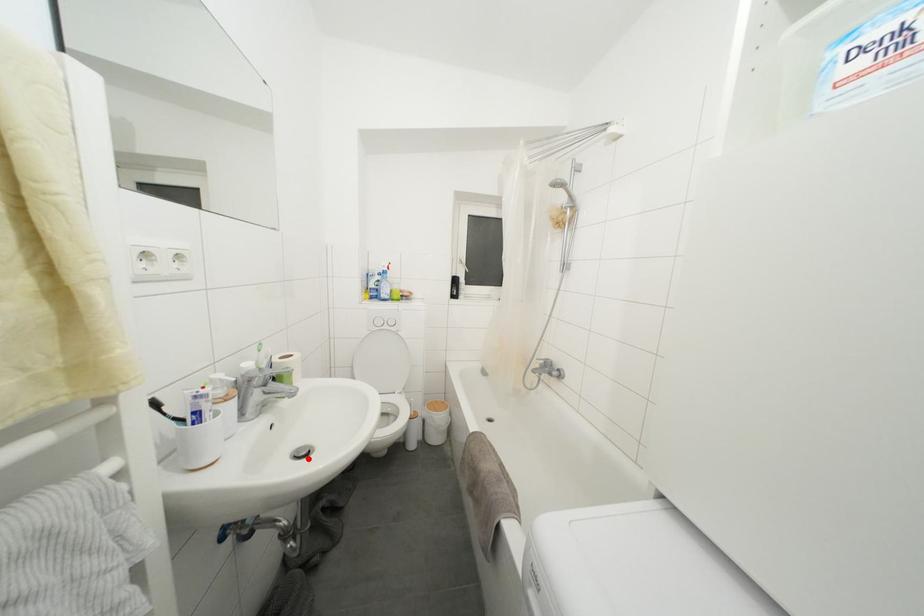
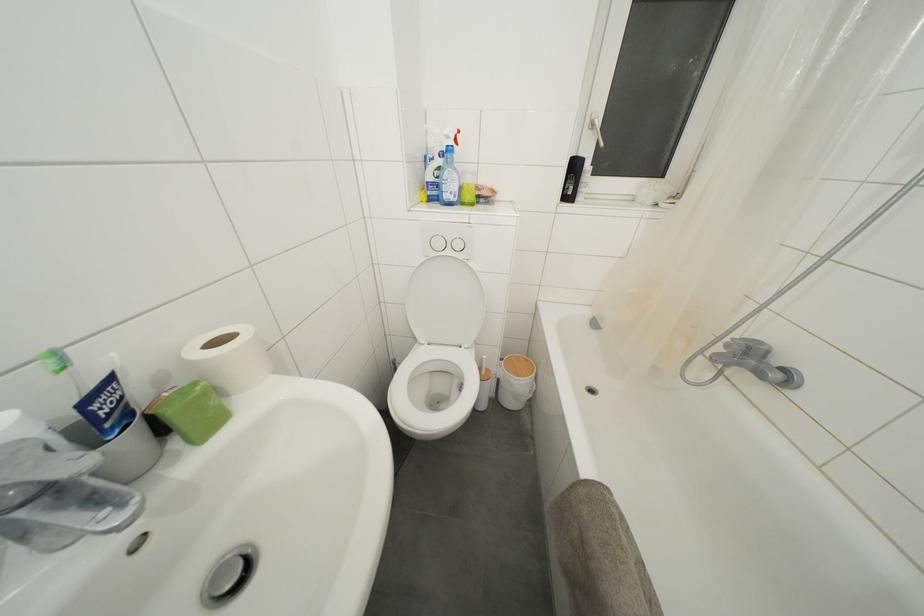
Question: A red point is marked in image1. In image2, is the corresponding 3D point closer to the camera or farther? Reply with the corresponding letter.

Choices:
 (A) The corresponding 3D point is closer.
 (B) The corresponding 3D point is farther.

Answer: (A)